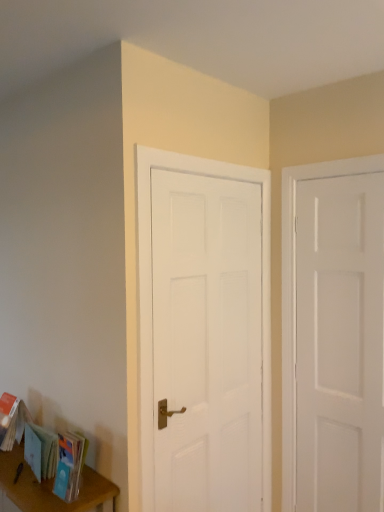
What are the coordinates of `wooden table at lower left` in the screenshot? It's located at (51, 487).

Image resolution: width=384 pixels, height=512 pixels. Describe the element at coordinates (69, 466) in the screenshot. I see `matte blue paperback book at lower left` at that location.

The height and width of the screenshot is (512, 384). I want to click on white matte door at right, the first door positioned from the right, so [339, 343].

Where is `wooden table at lower left`? wooden table at lower left is located at coordinates (51, 487).

Is wooden table at lower left closer to the viewer compared to white matte door at center, which appears as the first door when viewed from the left?

Yes, the depth of wooden table at lower left is less than that of white matte door at center, which appears as the first door when viewed from the left.

Which object is positioned more to the left, wooden table at lower left or white matte door at center, positioned as the 2th door in right-to-left order?

From the viewer's perspective, wooden table at lower left appears more on the left side.

From a real-world perspective, relative to white matte door at center, positioned as the 2th door in right-to-left order, is wooden table at lower left vertically above or below?

From a real-world perspective, wooden table at lower left is physically below white matte door at center, positioned as the 2th door in right-to-left order.

Is light blue paper book at lower left oriented away from matte blue paperback book at lower left?

No, matte blue paperback book at lower left is not at the back of light blue paper book at lower left.

Measure the distance from light blue paper book at lower left to matte blue paperback book at lower left.

The distance of light blue paper book at lower left from matte blue paperback book at lower left is 4.50 inches.

Is light blue paper book at lower left taller or shorter than matte blue paperback book at lower left?

In the image, light blue paper book at lower left appears to be shorter than matte blue paperback book at lower left.

Can you tell me how much light blue paper book at lower left and matte blue paperback book at lower left differ in facing direction?

4.33 degrees.

From a real-world perspective, is white matte door at center, which appears as the first door when viewed from the left, on top of light blue paper book at lower left?

Yes.

From the image's perspective, which one is positioned lower, white matte door at center, which appears as the first door when viewed from the left, or light blue paper book at lower left?

From the image's view, light blue paper book at lower left is below.

Is white matte door at center, positioned as the 2th door in right-to-left order, positioned with its back to light blue paper book at lower left?

No, white matte door at center, positioned as the 2th door in right-to-left order, is not facing away from light blue paper book at lower left.

At what (x,y) coordinates should I click in order to perform the action: click on door that is the 1st one above the light blue paper book at lower left (from a real-world perspective). Please return your answer as a coordinate pair (x, y). The width and height of the screenshot is (384, 512). Looking at the image, I should click on (207, 341).

Between matte blue paperback book at lower left and white matte door at right, the first door positioned from the right, which one appears on the left side from the viewer's perspective?

matte blue paperback book at lower left.

Is point (62, 459) less distant than point (331, 241)?

Yes.

Is matte blue paperback book at lower left bigger than white matte door at right, the first door positioned from the right?

Actually, matte blue paperback book at lower left might be smaller than white matte door at right, the first door positioned from the right.

Is matte blue paperback book at lower left aimed at white matte door at right, the first door positioned from the right?

No, matte blue paperback book at lower left is not aimed at white matte door at right, the first door positioned from the right.

In the scene shown: Choose the correct answer: Is white matte door at right, the 2th door in the left-to-right sequence, inside white matte door at center, which appears as the first door when viewed from the left, or outside it?

The correct answer is: outside.

Which of these two, white matte door at right, the 2th door in the left-to-right sequence, or white matte door at center, which appears as the first door when viewed from the left, is smaller?

Smaller between the two is white matte door at right, the 2th door in the left-to-right sequence.

What are the coordinates of `door below the white matte door at right, the 2th door in the left-to-right sequence (from the image's perspective)` in the screenshot? It's located at (207, 341).

From a real-world perspective, is white matte door at right, the first door positioned from the right, on white matte door at center, positioned as the 2th door in right-to-left order?

Indeed, from a real-world perspective, white matte door at right, the first door positioned from the right, stands above white matte door at center, positioned as the 2th door in right-to-left order.

Are matte blue paperback book at lower left and white matte door at center, which appears as the first door when viewed from the left, far apart?

No, matte blue paperback book at lower left is not far away from white matte door at center, which appears as the first door when viewed from the left.

Which is in front, point (72, 500) or point (186, 294)?

The point (72, 500) is closer to the camera.

Can you tell me how much matte blue paperback book at lower left and white matte door at center, which appears as the first door when viewed from the left, differ in facing direction?

matte blue paperback book at lower left and white matte door at center, which appears as the first door when viewed from the left, are facing 90.8 degrees away from each other.

Does matte blue paperback book at lower left have a greater width compared to white matte door at center, positioned as the 2th door in right-to-left order?

Yes, matte blue paperback book at lower left is wider than white matte door at center, positioned as the 2th door in right-to-left order.

Is wooden table at lower left not within white matte door at right, the first door positioned from the right?

Yes.

Based on the photo, considering the relative positions of wooden table at lower left and white matte door at right, the 2th door in the left-to-right sequence, in the image provided, is wooden table at lower left behind white matte door at right, the 2th door in the left-to-right sequence,?

No, wooden table at lower left is in front of white matte door at right, the 2th door in the left-to-right sequence.

Which of these two, wooden table at lower left or white matte door at right, the 2th door in the left-to-right sequence, stands shorter?

Standing shorter between the two is wooden table at lower left.

Are wooden table at lower left and white matte door at right, the 2th door in the left-to-right sequence, located far from each other?

That's right, there is a large distance between wooden table at lower left and white matte door at right, the 2th door in the left-to-right sequence.

The image size is (384, 512). Identify the location of table in front of the white matte door at center, positioned as the 2th door in right-to-left order. (51, 487).

This screenshot has width=384, height=512. I want to click on book that appears below the matte blue paperback book at lower left (from a real-world perspective), so click(x=40, y=451).

When comparing their distances from white matte door at right, the first door positioned from the right, does light blue paper book at lower left or matte blue paperback book at lower left seem further?

Based on the image, light blue paper book at lower left appears to be further to white matte door at right, the first door positioned from the right.

Which object lies nearer to the anchor point matte blue paperback book at lower left, white matte door at right, the 2th door in the left-to-right sequence, or light blue paper book at lower left?

light blue paper book at lower left lies closer to matte blue paperback book at lower left than the other object.

Which object lies nearer to the anchor point white matte door at center, which appears as the first door when viewed from the left, wooden table at lower left or white matte door at right, the 2th door in the left-to-right sequence?

white matte door at right, the 2th door in the left-to-right sequence.

From the image, which object appears to be farther from light blue paper book at lower left, white matte door at center, positioned as the 2th door in right-to-left order, or matte blue paperback book at lower left?

Based on the image, white matte door at center, positioned as the 2th door in right-to-left order, appears to be further to light blue paper book at lower left.

Based on their spatial positions, is light blue paper book at lower left or white matte door at right, the first door positioned from the right, further from white matte door at center, which appears as the first door when viewed from the left?

light blue paper book at lower left is further to white matte door at center, which appears as the first door when viewed from the left.

Based on their spatial positions, is white matte door at center, positioned as the 2th door in right-to-left order, or white matte door at right, the 2th door in the left-to-right sequence, further from light blue paper book at lower left?

white matte door at right, the 2th door in the left-to-right sequence, lies further to light blue paper book at lower left than the other object.

Looking at the image, which one is located further to matte blue paperback book at lower left, light blue paper book at lower left or wooden table at lower left?

Based on the image, wooden table at lower left appears to be further to matte blue paperback book at lower left.

Estimate the real-world distances between objects in this image. Which object is further from white matte door at center, positioned as the 2th door in right-to-left order, white matte door at right, the 2th door in the left-to-right sequence, or light blue paper book at lower left?

Among the two, light blue paper book at lower left is located further to white matte door at center, positioned as the 2th door in right-to-left order.

Locate an element on the screen. This screenshot has height=512, width=384. door situated between light blue paper book at lower left and white matte door at right, the 2th door in the left-to-right sequence, from left to right is located at coordinates (207, 341).

What are the coordinates of `book between matte blue paperback book at lower left and wooden table at lower left vertically` in the screenshot? It's located at (40, 451).

You are a GUI agent. You are given a task and a screenshot of the screen. Output one action in this format:
    pyautogui.click(x=<x>, y=<y>)
    Task: Click on the book located between wooden table at lower left and white matte door at right, the 2th door in the left-to-right sequence, in the left-right direction
    
    Given the screenshot: What is the action you would take?
    pyautogui.click(x=40, y=451)

Identify the location of door situated between matte blue paperback book at lower left and white matte door at right, the first door positioned from the right, from left to right. The image size is (384, 512). (207, 341).